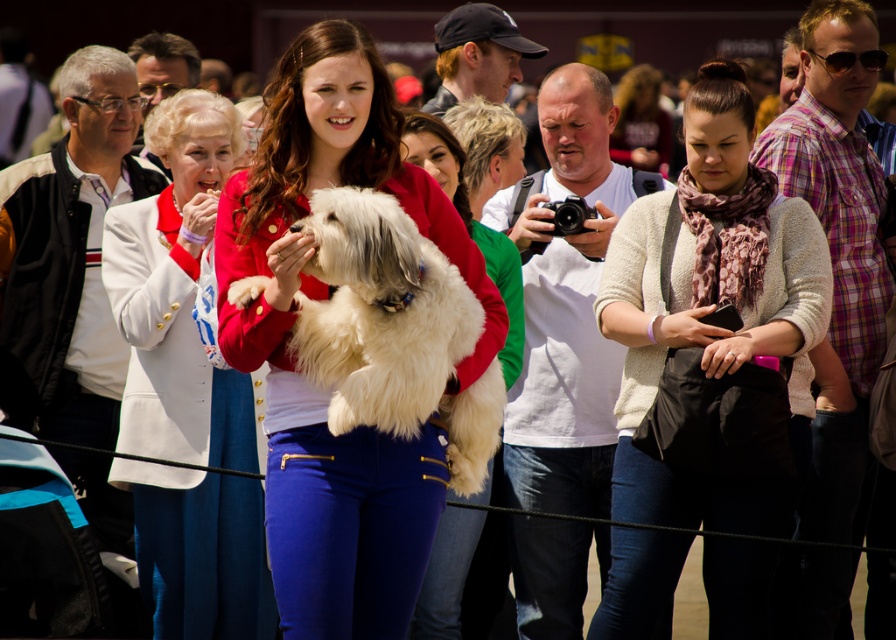
You are a photographer at the event and want to take a photo of the white fluffy dog at center without any distracting elements in the background. The white satin jacket at upper left is a potential distraction. Given their distance, can you frame the shot so the dog is centered and the jacket is out of the frame?

The white satin jacket at upper left is 4.90 meters away from the white fluffy dog at center. At this distance, with proper framing, the photographer can likely position the dog centrally while excluding the jacket from the shot, as 4.90 meters provides enough space to adjust the camera angle or zoom to eliminate the jacket from the background.

You are a photographer at the event and want to take a photo of both the matte red jacket at center and the beige sweater at center. Which object should you focus on first to ensure both are in sharp focus?

You should focus on the matte red jacket at center first because it is closer to the viewer than the beige sweater at center. By focusing on the closer object, the farther one may still be in acceptable focus depending on the depth of field.